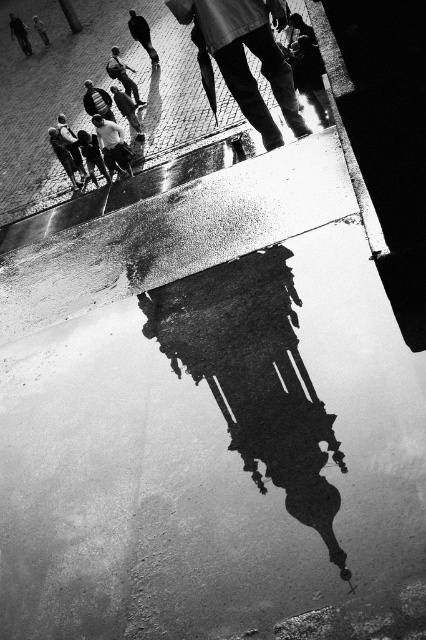
Consider the image. Is dark textured building at center in front of matte black helmet at center?

That is True.

Is dark textured building at center shorter than matte black helmet at center?

No, dark textured building at center is not shorter than matte black helmet at center.

Where is `dark textured building at center`? Image resolution: width=426 pixels, height=640 pixels. dark textured building at center is located at coordinates (255, 378).

Is point (150, 51) more distant than point (121, 93)?

That is True.

Does smooth leather shoe at center have a greater width compared to dark gray jeans at center?

Yes.

Which is in front, point (141, 35) or point (115, 97)?

Point (115, 97)

You are a GUI agent. You are given a task and a screenshot of the screen. Output one action in this format:
    pyautogui.click(x=<x>, y=<y>)
    Task: Click on the smooth leather shoe at center
    The width and height of the screenshot is (426, 640).
    Given the screenshot: What is the action you would take?
    pyautogui.click(x=141, y=35)

Which of these two, smooth leather pants at upper center or matte white shirt at lower left, stands taller?

Standing taller between the two is matte white shirt at lower left.

Looking at this image, does smooth leather pants at upper center appear on the left side of matte white shirt at lower left?

In fact, smooth leather pants at upper center is to the right of matte white shirt at lower left.

Which is behind, point (184, 20) or point (86, 173)?

Point (86, 173)

At what (x,y) coordinates should I click in order to perform the action: click on smooth leather pants at upper center. Please return your answer as a coordinate pair (x, y). Looking at the image, I should click on (245, 58).